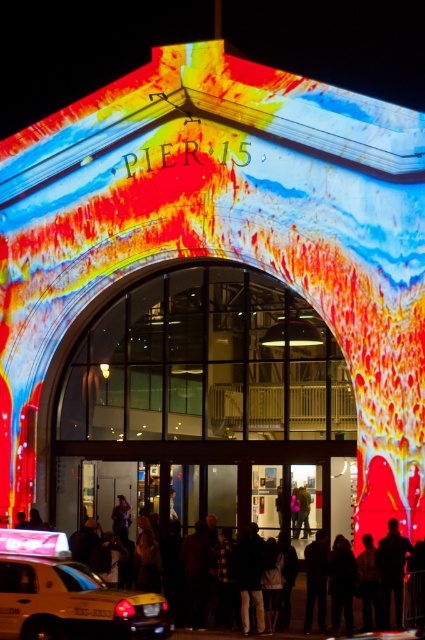
Between yellow matte taxi at lower left and black matte person at lower right, which one has more height?

yellow matte taxi at lower left is taller.

Between yellow matte taxi at lower left and black matte person at lower right, which one is positioned lower?

yellow matte taxi at lower left is below.

What are the coordinates of `yellow matte taxi at lower left` in the screenshot? It's located at (68, 595).